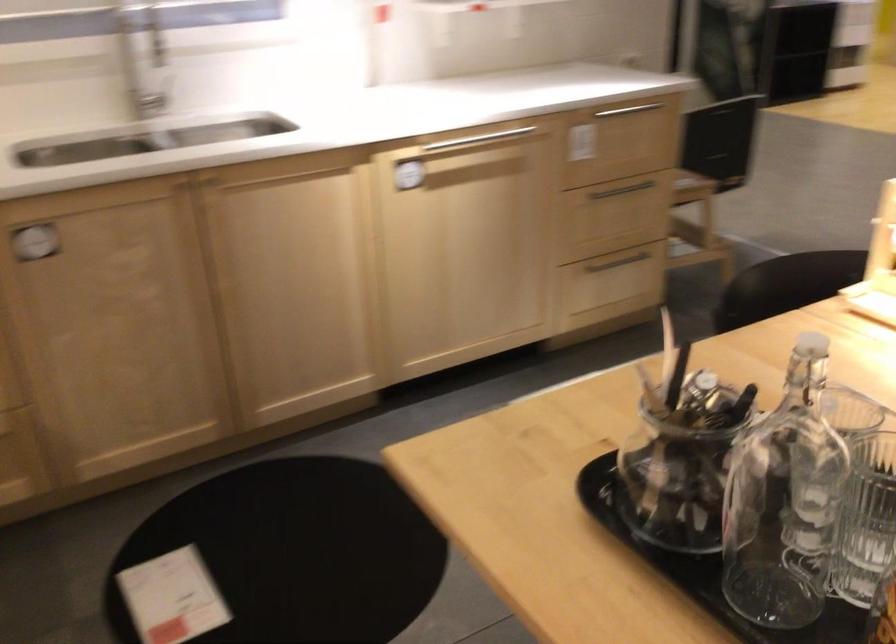
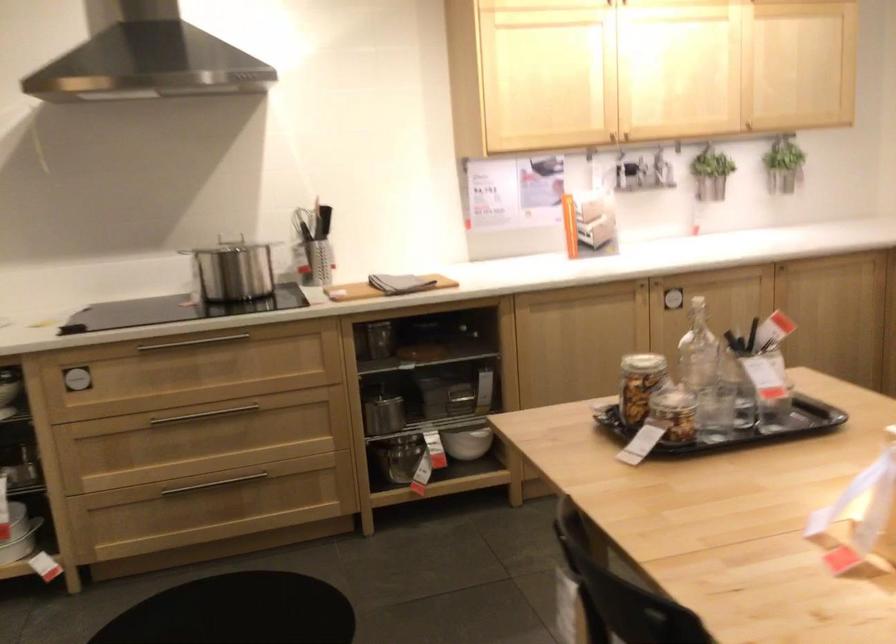
Question: I am providing you with two images of the same scene from different viewpoints. Which of the following objects are not visible in image2?

Choices:
 (A) black rectangular case
 (B) pot side handle
 (C) bottle stopper
 (D) clear glass bottle

Answer: (C)